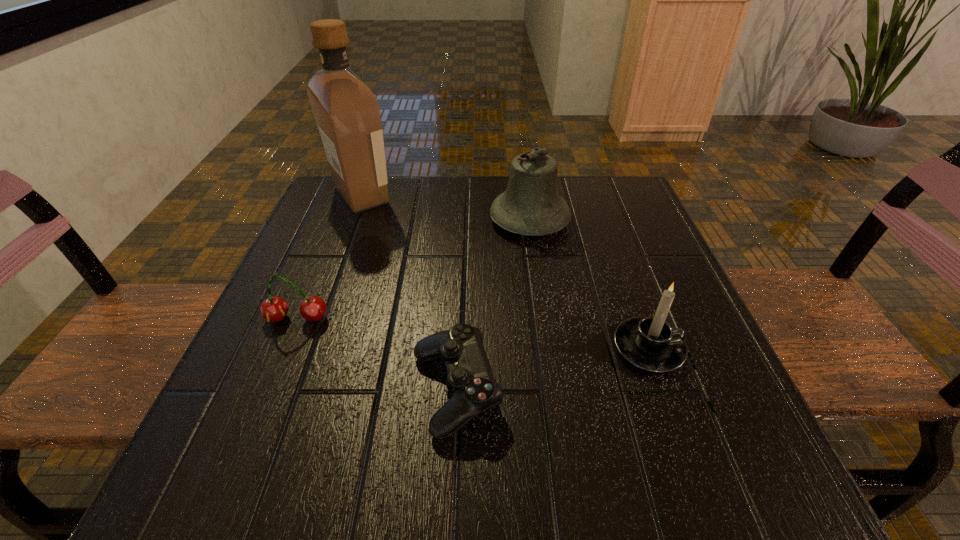
Locate an element on the screen. The image size is (960, 540). the tallest object is located at coordinates (347, 113).

The height and width of the screenshot is (540, 960). What are the coordinates of `bell` in the screenshot? It's located at (531, 205).

Identify the location of the rightmost object. (649, 343).

You are a GUI agent. You are given a task and a screenshot of the screen. Output one action in this format:
    pyautogui.click(x=<x>, y=<y>)
    Task: Click on the cherry
    Image resolution: width=960 pixels, height=540 pixels.
    Given the screenshot: What is the action you would take?
    pyautogui.click(x=313, y=308)

What are the coordinates of `control` in the screenshot? It's located at (470, 380).

Identify the location of vacant point located on the front-facing side of the liquor. (492, 195).

Image resolution: width=960 pixels, height=540 pixels. I want to click on blank space located on the left of the bell, so click(x=373, y=219).

This screenshot has height=540, width=960. Find the location of `free space located 0.050m with a handle on the side of the rightmost object`. free space located 0.050m with a handle on the side of the rightmost object is located at coordinates (714, 349).

Find the location of a particular element. vacant space located with stems pointing upwards on the cherry is located at coordinates (254, 421).

The image size is (960, 540). I want to click on vacant position located on the right of the control, so click(x=622, y=391).